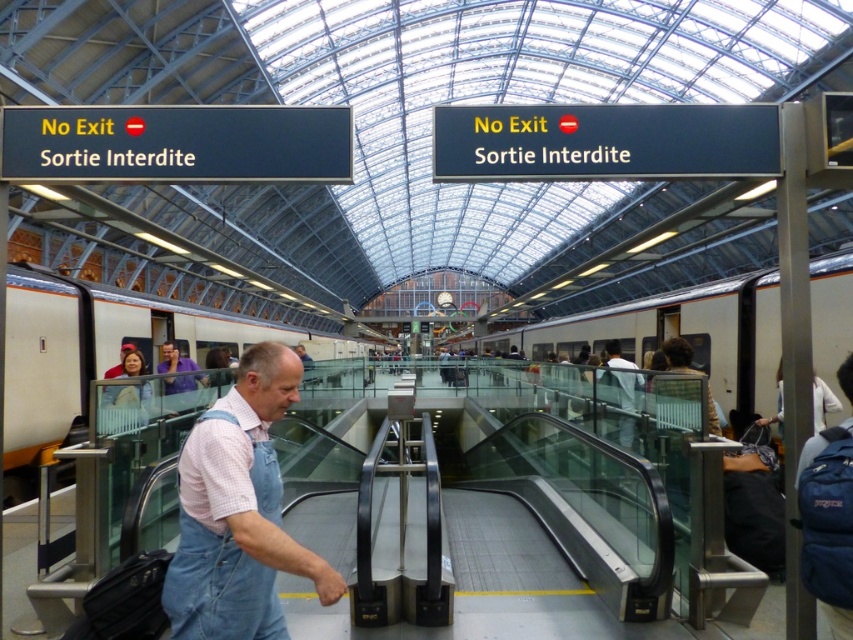
Does point (769, 563) come in front of point (184, 388)?

Yes, it is in front of point (184, 388).

Does black fabric backpack at lower right appear under purple shirt at center?

Yes, black fabric backpack at lower right is below purple shirt at center.

Is point (756, 467) farther from camera compared to point (194, 381)?

No.

This screenshot has width=853, height=640. In order to click on black fabric backpack at lower right in this screenshot , I will do `click(753, 504)`.

Between denim overalls at center and purple shirt at center, which one is positioned lower?

denim overalls at center is lower down.

Is denim overalls at center closer to the viewer compared to purple shirt at center?

Yes.

The image size is (853, 640). Identify the location of denim overalls at center. (238, 513).

Who is positioned more to the right, denim overalls at center or black fabric backpack at lower right?

From the viewer's perspective, black fabric backpack at lower right appears more on the right side.

You are a GUI agent. You are given a task and a screenshot of the screen. Output one action in this format:
    pyautogui.click(x=<x>, y=<y>)
    Task: Click on the denim overalls at center
    Image resolution: width=853 pixels, height=640 pixels.
    Given the screenshot: What is the action you would take?
    pyautogui.click(x=238, y=513)

Identify the location of denim overalls at center. (238, 513).